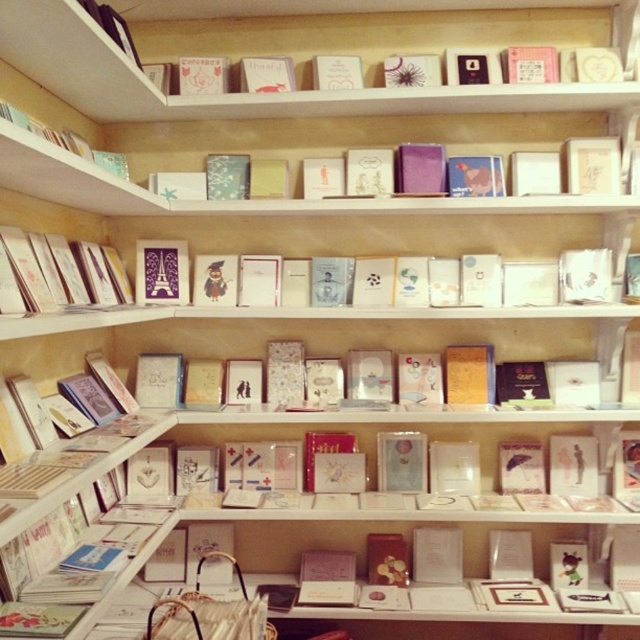
Can you confirm if matte pink card at center is taller than matte pink card at upper center?

Yes.

Does matte pink card at center appear on the left side of matte pink card at upper center?

Incorrect, matte pink card at center is not on the left side of matte pink card at upper center.

Which is in front, point (138, 336) or point (260, 65)?

Positioned in front is point (260, 65).

Where is `matte pink card at center`? The image size is (640, 640). matte pink card at center is located at coordinates (376, 340).

Does matte pink card at center have a larger size compared to matte paper greeting card at left?

Indeed, matte pink card at center has a larger size compared to matte paper greeting card at left.

Who is positioned more to the right, matte pink card at center or matte paper greeting card at left?

Positioned to the right is matte pink card at center.

The height and width of the screenshot is (640, 640). What do you see at coordinates (376, 340) in the screenshot?
I see `matte pink card at center` at bounding box center [376, 340].

Locate an element on the screen. The image size is (640, 640). matte pink card at center is located at coordinates (376, 340).

Is matte paper greeting card at left bigger than matte pink card at upper center?

Correct, matte paper greeting card at left is larger in size than matte pink card at upper center.

Is point (72, 296) positioned behind point (250, 72)?

No.

The height and width of the screenshot is (640, 640). What are the coordinates of `matte paper greeting card at left` in the screenshot? It's located at (44, 268).